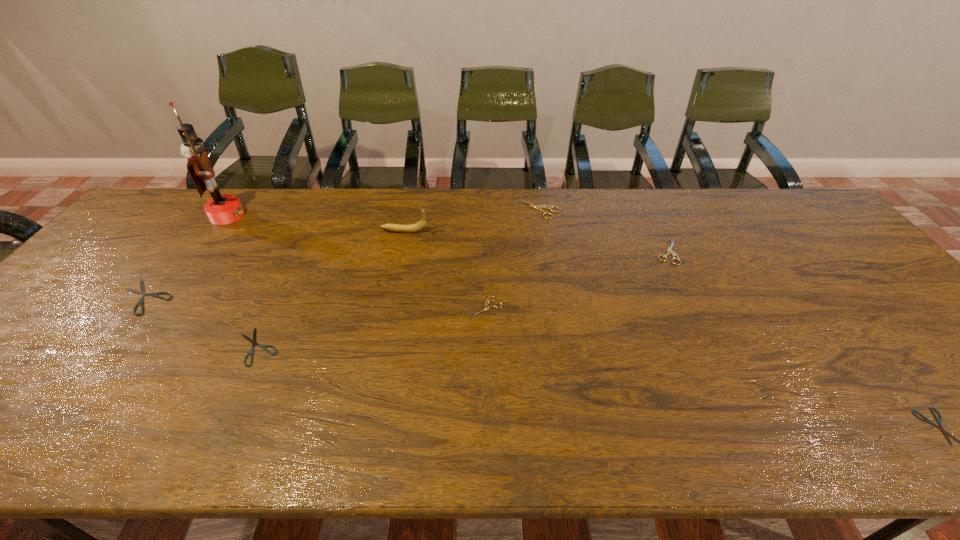
This screenshot has height=540, width=960. What are the coordinates of `shears that is the closest to the second smallest beige shears` in the screenshot? It's located at (538, 207).

Point out which shears is positioned as the second nearest to the third shears from left to right. Please provide its 2D coordinates. Your answer should be formatted as a tuple, i.e. [(x, y)], where the tuple contains the x and y coordinates of a point satisfying the conditions above.

[(253, 341)]

This screenshot has width=960, height=540. In order to click on beige shears that is the third nearest to the leftmost black shears in this screenshot , I will do `click(669, 251)`.

Find the location of `beige shears that is the closest to the fourth shears from right to left`. beige shears that is the closest to the fourth shears from right to left is located at coordinates (538, 207).

Select which black shears appears as the second closest to the third farthest object. Please provide its 2D coordinates. Your answer should be formatted as a tuple, i.e. [(x, y)], where the tuple contains the x and y coordinates of a point satisfying the conditions above.

[(141, 292)]

Locate which black shears ranks second in proximity to the nutcracker. Please provide its 2D coordinates. Your answer should be formatted as a tuple, i.e. [(x, y)], where the tuple contains the x and y coordinates of a point satisfying the conditions above.

[(253, 341)]

Find the location of a particular element. vacant point that satisfies the following two spatial constraints: 1. on the front-facing side of the nutcracker; 2. on the back side of the third object from left to right is located at coordinates (132, 347).